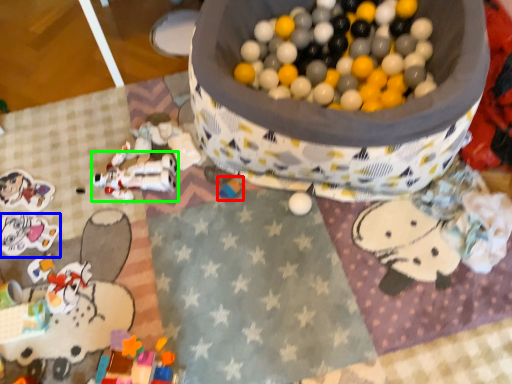
Question: Which is nearer to the toy (highlighted by a red box)? toy (highlighted by a blue box) or toy (highlighted by a green box).

Choices:
 (A) toy
 (B) toy

Answer: (B)